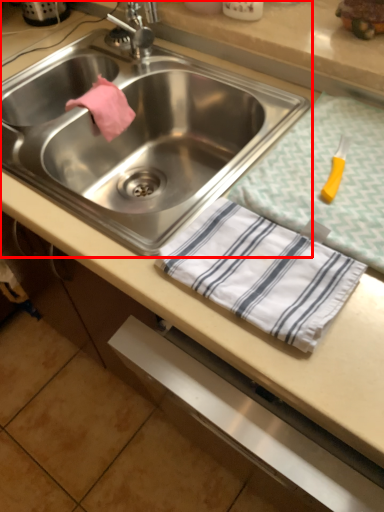
Question: Where is sink (annotated by the red box) located in relation to tablecloth in the image?

Choices:
 (A) left
 (B) right

Answer: (A)